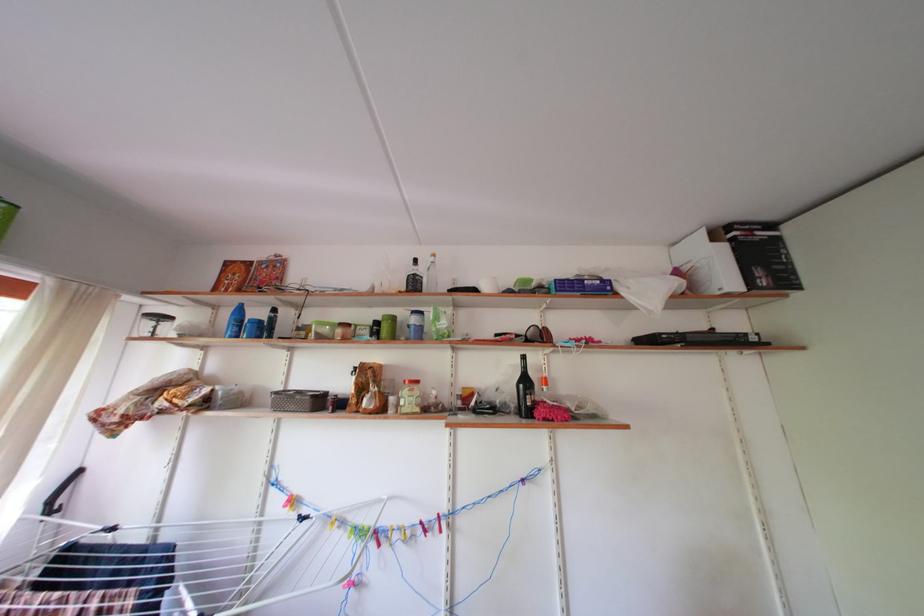
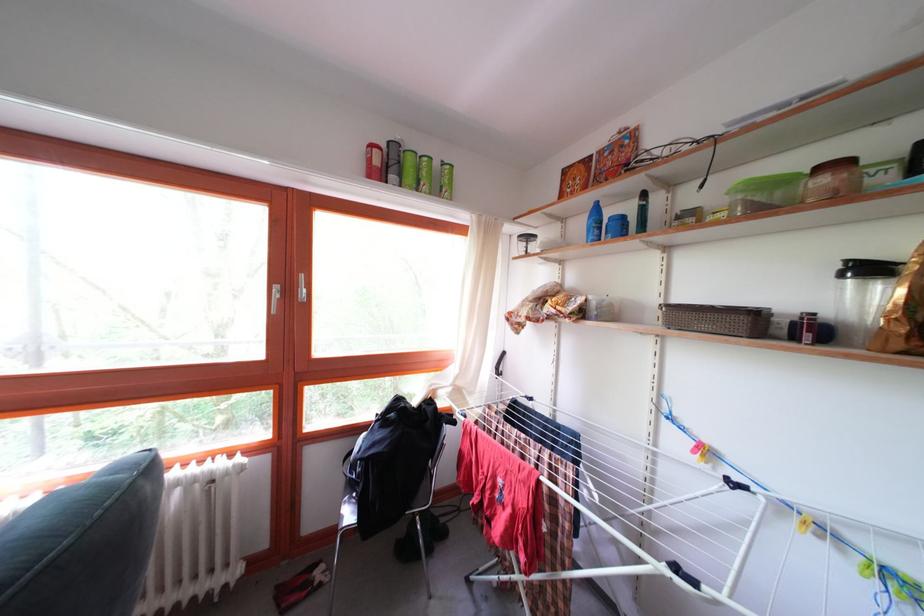
Locate, in the second image, the point that corresponds to [347,338] in the first image.

(832, 187)